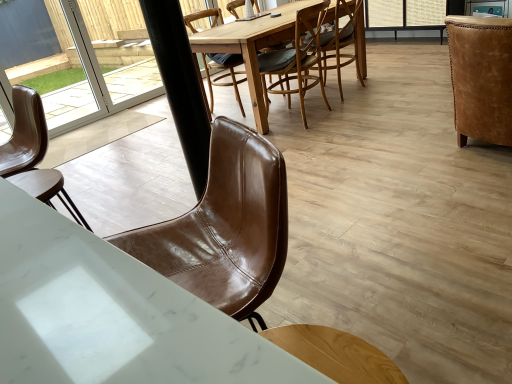
The image size is (512, 384). I want to click on vacant area in front of brown leather chair at center, positioned as the 4th chair in right-to-left order, so click(252, 13).